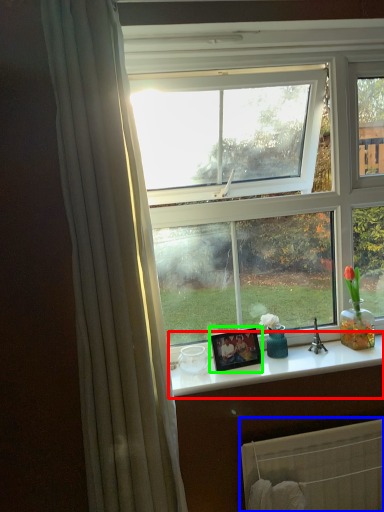
Question: Which object is the farthest from counter top (highlighted by a red box)? Choose among these: radiator (highlighted by a blue box) or picture frame (highlighted by a green box).

Choices:
 (A) radiator
 (B) picture frame

Answer: (A)